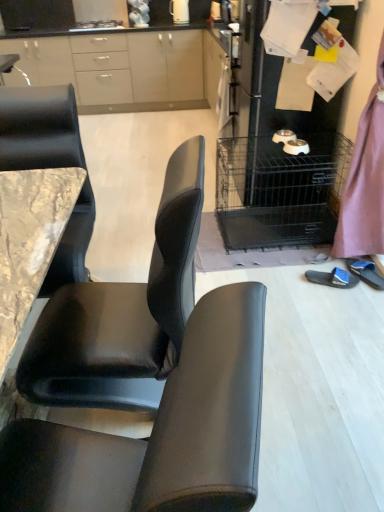
In order to face metallic silver pet bowls at right, should I rotate leftwards or rightwards?

Turn right approximately 11.806 degrees to face it.

What is the approximate width of white glossy electric kettle at upper center?

7.65 inches.

The height and width of the screenshot is (512, 384). Find the location of `matte white cabinets at upper left`. matte white cabinets at upper left is located at coordinates (125, 64).

Measure the distance between matte white cabinets at upper left and camera.

A distance of 3.99 meters exists between matte white cabinets at upper left and camera.

Describe the element at coordinates (160, 430) in the screenshot. I see `black leather chair at center` at that location.

Locate an element on the screen. This screenshot has height=512, width=384. purple satin dress at right is located at coordinates (365, 181).

Between blue fabric slipper at lower right, the 2th footwear viewed from the left, and black leather chair at center, which one has smaller size?

With smaller size is blue fabric slipper at lower right, the 2th footwear viewed from the left.

Considering the positions of point (371, 267) and point (18, 423), is point (371, 267) closer or farther from the camera than point (18, 423)?

Point (371, 267) is farther from the camera than point (18, 423).

Is blue fabric slipper at lower right, which is the first footwear from right to left, located outside black leather chair at center?

Result: blue fabric slipper at lower right, which is the first footwear from right to left, lies outside black leather chair at center's area.

From the image's perspective, which is above, blue fabric slipper at lower right, the 2th footwear viewed from the left, or black leather chair at center?

blue fabric slipper at lower right, the 2th footwear viewed from the left.

Can you confirm if purple satin dress at right is taller than blue fabric slipper at lower right, arranged as the second footwear when viewed from the right?

Yes, purple satin dress at right is taller than blue fabric slipper at lower right, arranged as the second footwear when viewed from the right.

Could you measure the distance between purple satin dress at right and blue fabric slipper at lower right, arranged as the second footwear when viewed from the right?

purple satin dress at right is 16.32 inches away from blue fabric slipper at lower right, arranged as the second footwear when viewed from the right.

Choose the correct answer: Is purple satin dress at right inside blue fabric slipper at lower right, marked as the 1th footwear in a left-to-right arrangement, or outside it?

purple satin dress at right is outside blue fabric slipper at lower right, marked as the 1th footwear in a left-to-right arrangement.

Is purple satin dress at right at the left side of blue fabric slipper at lower right, marked as the 1th footwear in a left-to-right arrangement?

No.

Does white glossy electric kettle at upper center have a lesser height compared to matte white cabinets at upper left?

Correct, white glossy electric kettle at upper center is not as tall as matte white cabinets at upper left.

Between point (182, 19) and point (204, 9), which one is positioned in front?

The point (204, 9) is closer.

Is white glossy electric kettle at upper center facing towards matte white cabinets at upper left?

No, white glossy electric kettle at upper center does not turn towards matte white cabinets at upper left.

How different are the orientations of white glossy electric kettle at upper center and matte white cabinets at upper left in degrees?

The facing directions of white glossy electric kettle at upper center and matte white cabinets at upper left are 0.000642 degrees apart.

Are metallic silver pet bowls at right and purple satin dress at right making contact?

No, metallic silver pet bowls at right is not next to purple satin dress at right.

Between metallic silver pet bowls at right and purple satin dress at right, which one has less height?

With less height is metallic silver pet bowls at right.

Where is `appliance behind the purple satin dress at right`? appliance behind the purple satin dress at right is located at coordinates (x=277, y=157).

Is metallic silver pet bowls at right bigger than purple satin dress at right?

Indeed, metallic silver pet bowls at right has a larger size compared to purple satin dress at right.

Is black leather chair at center thinner than white glossy electric kettle at upper center?

In fact, black leather chair at center might be wider than white glossy electric kettle at upper center.

Considering the positions of points (72, 431) and (180, 12), is point (72, 431) closer to camera compared to point (180, 12)?

Yes, it is.

Between black leather chair at center and white glossy electric kettle at upper center, which one appears on the right side from the viewer's perspective?

Positioned to the right is white glossy electric kettle at upper center.

Would you say black leather chair at center is inside or outside white glossy electric kettle at upper center?

black leather chair at center cannot be found inside white glossy electric kettle at upper center.

Is metallic silver pet bowls at right further to the viewer compared to blue fabric slipper at lower right, the 2th footwear viewed from the left?

Yes, metallic silver pet bowls at right is further from the camera.

Looking at this image, from their relative heights in the image, would you say metallic silver pet bowls at right is taller or shorter than blue fabric slipper at lower right, which is the first footwear from right to left?

In the image, metallic silver pet bowls at right appears to be taller than blue fabric slipper at lower right, which is the first footwear from right to left.

Between metallic silver pet bowls at right and blue fabric slipper at lower right, which is the first footwear from right to left, which one has smaller size?

With smaller size is blue fabric slipper at lower right, which is the first footwear from right to left.

Which object is thinner, purple satin dress at right or matte white cabinets at upper left?

purple satin dress at right is thinner.

From a real-world perspective, which is physically above, purple satin dress at right or matte white cabinets at upper left?

purple satin dress at right.

In the scene shown: Are purple satin dress at right and matte white cabinets at upper left beside each other?

purple satin dress at right and matte white cabinets at upper left are not in contact.

Is purple satin dress at right bigger than matte white cabinets at upper left?

Actually, purple satin dress at right might be smaller than matte white cabinets at upper left.

I want to click on chair above the blue fabric slipper at lower right, which is the first footwear from right to left (from a real-world perspective), so click(x=160, y=430).

You are a GUI agent. You are given a task and a screenshot of the screen. Output one action in this format:
    pyautogui.click(x=<x>, y=<y>)
    Task: Click on the dress in front of the blue fabric slipper at lower right, arranged as the second footwear when viewed from the right
    
    Given the screenshot: What is the action you would take?
    pyautogui.click(x=365, y=181)

Based on their spatial positions, is white glossy electric kettle at upper center or metallic silver pet bowls at right further from black leather chair at center?

The object further to black leather chair at center is white glossy electric kettle at upper center.

From the picture: When comparing their distances from metallic silver pet bowls at right, does white glossy electric kettle at upper center or blue fabric slipper at lower right, which is the first footwear from right to left, seem closer?

Based on the image, blue fabric slipper at lower right, which is the first footwear from right to left, appears to be nearer to metallic silver pet bowls at right.

When comparing their distances from black leather chair at center, does matte white cabinets at upper left or blue fabric slipper at lower right, marked as the 1th footwear in a left-to-right arrangement, seem further?

matte white cabinets at upper left is further to black leather chair at center.

From the image, which object appears to be farther from matte white cabinets at upper left, blue fabric slipper at lower right, marked as the 1th footwear in a left-to-right arrangement, or blue fabric slipper at lower right, which is the first footwear from right to left?

blue fabric slipper at lower right, which is the first footwear from right to left, is positioned further to the anchor matte white cabinets at upper left.

From the image, which object appears to be nearer to white glossy electric kettle at upper center, black leather chair at center or purple satin dress at right?

purple satin dress at right is positioned closer to the anchor white glossy electric kettle at upper center.

Which object lies further to the anchor point matte white cabinets at upper left, white glossy electric kettle at upper center or metallic silver pet bowls at right?

Among the two, metallic silver pet bowls at right is located further to matte white cabinets at upper left.

When comparing their distances from matte white cabinets at upper left, does white glossy electric kettle at upper center or blue fabric slipper at lower right, the 2th footwear viewed from the left, seem closer?

The object closer to matte white cabinets at upper left is white glossy electric kettle at upper center.

Considering their positions, is purple satin dress at right positioned closer to blue fabric slipper at lower right, arranged as the second footwear when viewed from the right, than black leather chair at center?

purple satin dress at right is closer to blue fabric slipper at lower right, arranged as the second footwear when viewed from the right.

Identify the location of dress between black leather chair at center and matte white cabinets at upper left along the z-axis. (365, 181).

Locate an element on the screen. Image resolution: width=384 pixels, height=512 pixels. appliance positioned between blue fabric slipper at lower right, which is the first footwear from right to left, and matte white cabinets at upper left from near to far is located at coordinates (277, 157).

Image resolution: width=384 pixels, height=512 pixels. I want to click on footwear between white glossy electric kettle at upper center and blue fabric slipper at lower right, arranged as the second footwear when viewed from the right, in the up-down direction, so click(x=366, y=272).

Where is `footwear located between purple satin dress at right and blue fabric slipper at lower right, arranged as the second footwear when viewed from the right, in the depth direction`? footwear located between purple satin dress at right and blue fabric slipper at lower right, arranged as the second footwear when viewed from the right, in the depth direction is located at coordinates click(x=366, y=272).